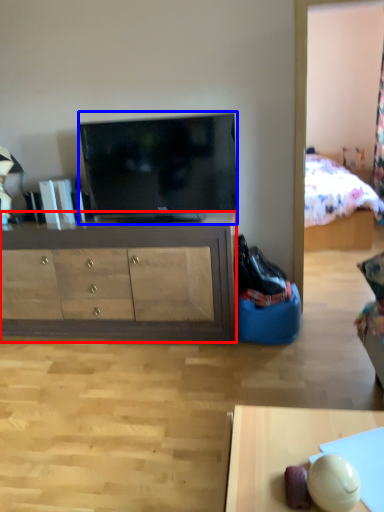
Question: Among these objects, which one is nearest to the camera, cabinetry (highlighted by a red box) or television (highlighted by a blue box)?

Choices:
 (A) cabinetry
 (B) television

Answer: (B)